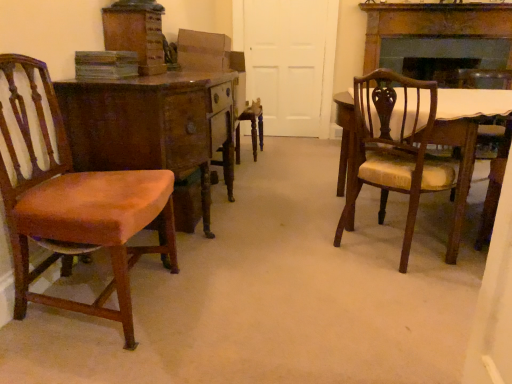
Question: Considering the relative sizes of matte brown chair at left, the first chair from the left, and matte brown chair at right, positioned as the first chair in right-to-left order, in the image provided, is matte brown chair at left, the first chair from the left, thinner than matte brown chair at right, positioned as the first chair in right-to-left order,?

Choices:
 (A) no
 (B) yes

Answer: (A)

Question: From the image's perspective, is matte brown chair at left, which appears as the 2th chair when viewed from the right, on top of matte brown chair at right, positioned as the 2th chair in left-to-right order?

Choices:
 (A) no
 (B) yes

Answer: (A)

Question: From a real-world perspective, is matte brown chair at left, the first chair from the left, positioned under matte brown chair at right, positioned as the 2th chair in left-to-right order, based on gravity?

Choices:
 (A) no
 (B) yes

Answer: (A)

Question: Is matte brown chair at left, the first chair from the left, bigger than matte brown chair at right, positioned as the first chair in right-to-left order?

Choices:
 (A) yes
 (B) no

Answer: (A)

Question: Can you confirm if matte brown chair at left, the first chair from the left, is smaller than matte brown chair at right, positioned as the 2th chair in left-to-right order?

Choices:
 (A) yes
 (B) no

Answer: (B)

Question: In the image, is wooden desk at left positioned in front of or behind matte brown chair at right, positioned as the 2th chair in left-to-right order?

Choices:
 (A) front
 (B) behind

Answer: (B)

Question: Looking at their shapes, would you say wooden desk at left is wider or thinner than matte brown chair at right, positioned as the first chair in right-to-left order?

Choices:
 (A) wide
 (B) thin

Answer: (A)

Question: Would you say wooden desk at left is to the left or to the right of matte brown chair at right, positioned as the 2th chair in left-to-right order, in the picture?

Choices:
 (A) right
 (B) left

Answer: (B)

Question: In terms of height, does wooden desk at left look taller or shorter compared to matte brown chair at right, positioned as the 2th chair in left-to-right order?

Choices:
 (A) tall
 (B) short

Answer: (B)

Question: Based on their positions, is matte brown chair at right, positioned as the first chair in right-to-left order, located to the left or right of wooden desk at left?

Choices:
 (A) left
 (B) right

Answer: (B)

Question: From the image's perspective, is matte brown chair at right, positioned as the first chair in right-to-left order, above or below wooden desk at left?

Choices:
 (A) below
 (B) above

Answer: (A)

Question: Relative to wooden desk at left, is matte brown chair at right, positioned as the first chair in right-to-left order, in front or behind?

Choices:
 (A) behind
 (B) front

Answer: (B)

Question: From a real-world perspective, is matte brown chair at right, positioned as the 2th chair in left-to-right order, positioned above or below wooden desk at left?

Choices:
 (A) below
 (B) above

Answer: (B)

Question: From a real-world perspective, relative to matte brown chair at left, the first chair from the left, is wooden desk at left vertically above or below?

Choices:
 (A) below
 (B) above

Answer: (A)

Question: Which is correct: wooden desk at left is inside matte brown chair at left, which appears as the 2th chair when viewed from the right, or outside of it?

Choices:
 (A) inside
 (B) outside

Answer: (B)